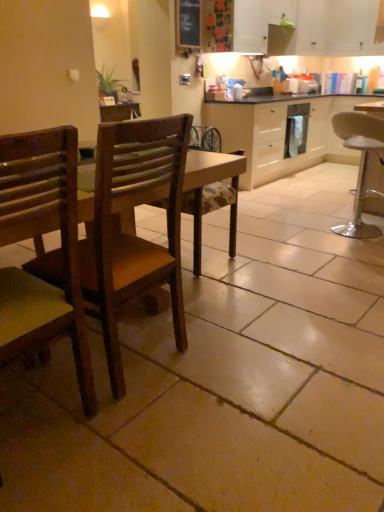
The height and width of the screenshot is (512, 384). What do you see at coordinates (296, 129) in the screenshot?
I see `white glossy dishwasher at center` at bounding box center [296, 129].

Describe the element at coordinates (309, 26) in the screenshot. I see `white matte cabinet at upper center, marked as the 2th cabinetry in a bottom-to-top arrangement` at that location.

What do you see at coordinates (351, 28) in the screenshot?
I see `white matte cabinet at upper right, the 1th cabinetry from the top` at bounding box center [351, 28].

This screenshot has height=512, width=384. What do you see at coordinates (360, 164) in the screenshot?
I see `white plastic stool at right, which is counted as the 3th chair, starting from the left` at bounding box center [360, 164].

Locate an element on the screen. The width and height of the screenshot is (384, 512). white plastic stool at right, which appears as the 1th chair when viewed from the right is located at coordinates (360, 164).

This screenshot has height=512, width=384. In order to click on white matte cabinet at center, which is the first cabinetry from bottom to top in this screenshot , I will do pyautogui.click(x=279, y=133).

From the image's perspective, would you say white plastic stool at right, which is counted as the 3th chair, starting from the left, is positioned over white matte cabinet at upper center, the second cabinetry viewed from the top?

No, from the image's perspective, white plastic stool at right, which is counted as the 3th chair, starting from the left, is not over white matte cabinet at upper center, the second cabinetry viewed from the top.

Between white plastic stool at right, which is counted as the 3th chair, starting from the left, and white matte cabinet at upper center, the second cabinetry viewed from the top, which one has larger size?

white matte cabinet at upper center, the second cabinetry viewed from the top.

Is white plastic stool at right, which appears as the 1th chair when viewed from the right, positioned beyond the bounds of white matte cabinet at upper center, marked as the 2th cabinetry in a bottom-to-top arrangement?

Yes, white plastic stool at right, which appears as the 1th chair when viewed from the right, is outside of white matte cabinet at upper center, marked as the 2th cabinetry in a bottom-to-top arrangement.

Considering the positions of points (354, 143) and (260, 20), is point (354, 143) closer to camera compared to point (260, 20)?

Yes, point (354, 143) is in front of point (260, 20).

What's the angular difference between white matte cabinet at upper right, acting as the third cabinetry starting from the bottom, and chalkboard at upper center's facing directions?

The angle between the facing direction of white matte cabinet at upper right, acting as the third cabinetry starting from the bottom, and the facing direction of chalkboard at upper center is 90.8 degrees.

Which object is further away from the camera taking this photo, white matte cabinet at upper right, the 1th cabinetry from the top, or chalkboard at upper center?

white matte cabinet at upper right, the 1th cabinetry from the top.

Consider the image. Which is correct: white matte cabinet at upper right, the 1th cabinetry from the top, is inside chalkboard at upper center, or outside of it?

The correct answer is: outside.

Looking at this image, could you tell me if white matte cabinet at upper right, the 1th cabinetry from the top, is facing chalkboard at upper center?

Yes, white matte cabinet at upper right, the 1th cabinetry from the top, faces towards chalkboard at upper center.

Is wooden chair at left, which is counted as the first chair, starting from the front, with white matte cabinet at upper right, acting as the third cabinetry starting from the bottom?

wooden chair at left, which is counted as the first chair, starting from the front, and white matte cabinet at upper right, acting as the third cabinetry starting from the bottom, are not in contact.

Is point (0, 145) positioned after point (374, 13)?

That is False.

Is wooden chair at left, positioned as the 1th chair in left-to-right order, wider than white matte cabinet at upper right, the 1th cabinetry from the top?

Yes.

From a real-world perspective, is wooden chair at left, which is the third chair from right to left, above or below white matte cabinet at upper right, the 1th cabinetry from the top?

Clearly, from a real-world perspective, wooden chair at left, which is the third chair from right to left, is below white matte cabinet at upper right, the 1th cabinetry from the top.

Considering the positions of point (184, 41) and point (293, 130), is point (184, 41) closer or farther from the camera than point (293, 130)?

Clearly, point (184, 41) is closer to the camera than point (293, 130).

From the image's perspective, is chalkboard at upper center above or below white glossy dishwasher at center?

Clearly, from the image's perspective, chalkboard at upper center is above white glossy dishwasher at center.

How many degrees apart are the facing directions of chalkboard at upper center and white glossy dishwasher at center?

0.807 degrees separate the facing orientations of chalkboard at upper center and white glossy dishwasher at center.

Would you say chalkboard at upper center is to the left or to the right of white glossy dishwasher at center in the picture?

chalkboard at upper center is to the left of white glossy dishwasher at center.

Does point (285, 122) lie behind point (122, 367)?

Yes, it is behind point (122, 367).

Based on their sizes in the image, would you say white matte cabinet at center, which is the 3th cabinetry from top to bottom, is bigger or smaller than wooden chair at left, placed as the second chair when sorted from front to back?

In the image, white matte cabinet at center, which is the 3th cabinetry from top to bottom, appears to be larger than wooden chair at left, placed as the second chair when sorted from front to back.

From the image's perspective, would you say white matte cabinet at center, which is the first cabinetry from bottom to top, is shown under wooden chair at left, placed as the second chair when sorted from front to back?

No, from the image's perspective, white matte cabinet at center, which is the first cabinetry from bottom to top, is not below wooden chair at left, placed as the second chair when sorted from front to back.

Considering the positions of objects white matte cabinet at center, which is the first cabinetry from bottom to top, and wooden chair at left, the second chair when ordered from left to right, in the image provided, who is more to the left, white matte cabinet at center, which is the first cabinetry from bottom to top, or wooden chair at left, the second chair when ordered from left to right,?

Positioned to the left is wooden chair at left, the second chair when ordered from left to right.

Which object is positioned more to the left, white matte cabinet at upper right, the 1th cabinetry from the top, or white plastic stool at right, which is counted as the 3th chair, starting from the left?

white plastic stool at right, which is counted as the 3th chair, starting from the left, is more to the left.

From the image's perspective, which one is positioned lower, white matte cabinet at upper right, acting as the third cabinetry starting from the bottom, or white plastic stool at right, which appears as the 1th chair when viewed from the right?

From the image's view, white plastic stool at right, which appears as the 1th chair when viewed from the right, is below.

Is white matte cabinet at upper right, acting as the third cabinetry starting from the bottom, placed right next to white plastic stool at right, which appears as the 1th chair when viewed from the right?

They are not placed beside each other.

From a real-world perspective, is wooden chair at left, which appears as the second chair when viewed from the right, below wooden chair at left, acting as the third chair starting from the back?

No, from a real-world perspective, wooden chair at left, which appears as the second chair when viewed from the right, is not beneath wooden chair at left, acting as the third chair starting from the back.

Consider the image. Is wooden chair at left, placed as the second chair when sorted from front to back, beside wooden chair at left, which is counted as the first chair, starting from the front?

They are not placed beside each other.

Which is more to the left, wooden chair at left, acting as the second chair starting from the back, or wooden chair at left, positioned as the 1th chair in left-to-right order?

Positioned to the left is wooden chair at left, positioned as the 1th chair in left-to-right order.

At what (x,y) coordinates should I click in order to perform the action: click on cabinetry that is the 3rd one above the white plastic stool at right, which is counted as the 3th chair, starting from the left (from a real-world perspective). Please return your answer as a coordinate pair (x, y). Looking at the image, I should click on (309, 26).

Image resolution: width=384 pixels, height=512 pixels. Find the location of `the 2nd cabinetry above the chalkboard at upper center (from the image's perspective)`. the 2nd cabinetry above the chalkboard at upper center (from the image's perspective) is located at coordinates (351, 28).

Which object lies further to the anchor point white matte cabinet at upper center, the second cabinetry viewed from the top, chalkboard at upper center or white glossy dishwasher at center?

chalkboard at upper center is further to white matte cabinet at upper center, the second cabinetry viewed from the top.

Based on their spatial positions, is white plastic stool at right, which appears as the 1th chair when viewed from the right, or white matte cabinet at center, which is the 3th cabinetry from top to bottom, closer to chalkboard at upper center?

white matte cabinet at center, which is the 3th cabinetry from top to bottom, lies closer to chalkboard at upper center than the other object.

Which object lies further to the anchor point wooden chair at left, which appears as the second chair when viewed from the right, white glossy dishwasher at center or white matte cabinet at upper center, marked as the 2th cabinetry in a bottom-to-top arrangement?

The object further to wooden chair at left, which appears as the second chair when viewed from the right, is white matte cabinet at upper center, marked as the 2th cabinetry in a bottom-to-top arrangement.

When comparing their distances from white glossy dishwasher at center, does wooden chair at left, which is counted as the first chair, starting from the front, or white matte cabinet at upper center, the second cabinetry viewed from the top, seem further?

Based on the image, wooden chair at left, which is counted as the first chair, starting from the front, appears to be further to white glossy dishwasher at center.

Based on their spatial positions, is white plastic stool at right, the 3th chair positioned from the front, or white matte cabinet at upper center, the second cabinetry viewed from the top, closer to chalkboard at upper center?

white matte cabinet at upper center, the second cabinetry viewed from the top, is closer to chalkboard at upper center.

Which object lies nearer to the anchor point wooden chair at left, which appears as the second chair when viewed from the right, white matte cabinet at upper right, acting as the third cabinetry starting from the bottom, or white matte cabinet at upper center, the second cabinetry viewed from the top?

Among the two, white matte cabinet at upper center, the second cabinetry viewed from the top, is located nearer to wooden chair at left, which appears as the second chair when viewed from the right.

From the image, which object appears to be nearer to wooden chair at left, which appears as the second chair when viewed from the right, white glossy dishwasher at center or white plastic stool at right, which is counted as the 3th chair, starting from the left?

white plastic stool at right, which is counted as the 3th chair, starting from the left, is closer to wooden chair at left, which appears as the second chair when viewed from the right.

Looking at the image, which one is located closer to white matte cabinet at center, which is the first cabinetry from bottom to top, white matte cabinet at upper center, the second cabinetry viewed from the top, or chalkboard at upper center?

white matte cabinet at upper center, the second cabinetry viewed from the top.

What are the coordinates of `cabinetry between white matte cabinet at upper right, acting as the third cabinetry starting from the bottom, and white matte cabinet at center, which is the 3th cabinetry from top to bottom, in the vertical direction` in the screenshot? It's located at (309, 26).

I want to click on bulletin board between white matte cabinet at upper center, marked as the 2th cabinetry in a bottom-to-top arrangement, and white plastic stool at right, the 3th chair positioned from the front, from top to bottom, so click(187, 25).

The image size is (384, 512). In order to click on bulletin board between wooden chair at left, acting as the second chair starting from the back, and white matte cabinet at center, which is the 3th cabinetry from top to bottom, along the z-axis in this screenshot , I will do `click(187, 25)`.

At what (x,y) coordinates should I click in order to perform the action: click on bulletin board between wooden chair at left, acting as the second chair starting from the back, and white matte cabinet at upper right, the 1th cabinetry from the top, in the front-back direction. Please return your answer as a coordinate pair (x, y). The width and height of the screenshot is (384, 512). Looking at the image, I should click on (187, 25).